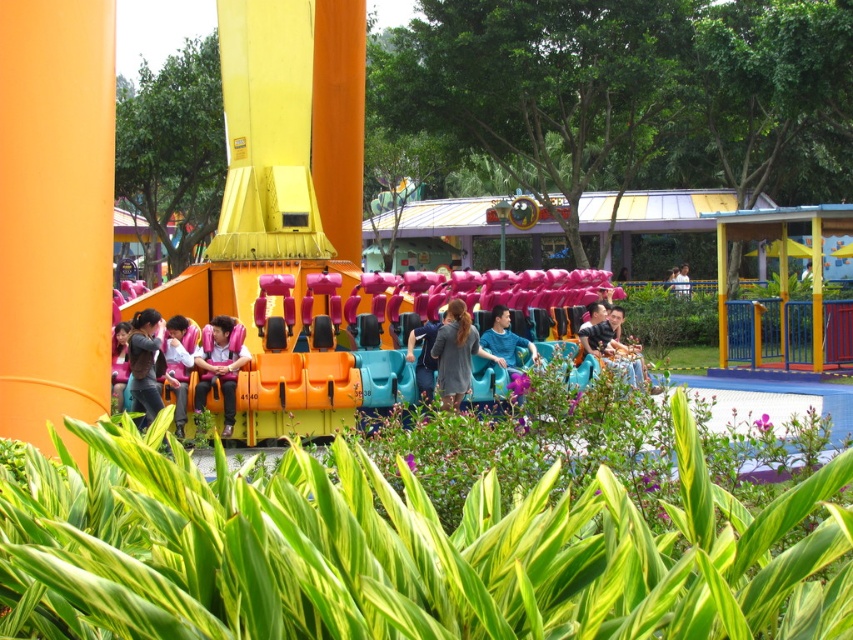
Question: Does matte pink shirt at center have a greater width compared to blue denim jeans at center?

Choices:
 (A) yes
 (B) no

Answer: (A)

Question: Can you confirm if green leafy plants at lower center is positioned to the left of matte pink shirt at center?

Choices:
 (A) yes
 (B) no

Answer: (B)

Question: Which object is positioned farthest from the gray fabric dress at center?

Choices:
 (A) matte black shirt at left
 (B) green leafy plants at lower center
 (C) blue denim jeans at center

Answer: (B)

Question: Which object is closer to the camera taking this photo?

Choices:
 (A) matte black shirt at left
 (B) matte pink shirt at center
 (C) green leafy plants at lower center

Answer: (C)

Question: Which point is closer to the camera?

Choices:
 (A) pyautogui.click(x=698, y=508)
 (B) pyautogui.click(x=500, y=362)

Answer: (A)

Question: Is matte orange seat at center positioned in front of blue denim jeans at center?

Choices:
 (A) yes
 (B) no

Answer: (A)